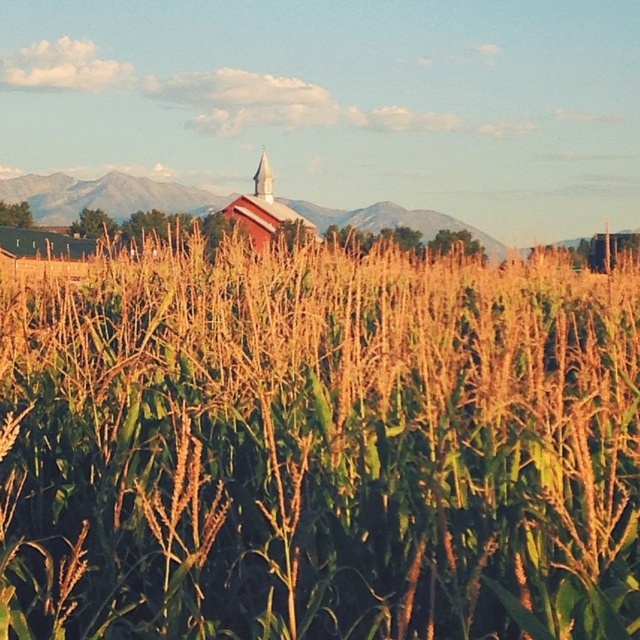
Question: Is green leafy corn at center to the left of smooth silver spire at center from the viewer's perspective?

Choices:
 (A) yes
 (B) no

Answer: (B)

Question: Does green leafy corn at center appear on the right side of matte red barn at center?

Choices:
 (A) no
 (B) yes

Answer: (B)

Question: Which is nearer to the matte red barn at center?

Choices:
 (A) green leafy corn at center
 (B) smooth silver spire at center

Answer: (B)

Question: Among these objects, which one is nearest to the camera?

Choices:
 (A) green leafy corn at center
 (B) matte red barn at center
 (C) smooth silver spire at center

Answer: (A)

Question: Which of the following is the farthest from the observer?

Choices:
 (A) (256, 232)
 (B) (262, 186)

Answer: (B)

Question: Considering the relative positions of green leafy corn at center and matte red barn at center in the image provided, where is green leafy corn at center located with respect to matte red barn at center?

Choices:
 (A) left
 (B) right

Answer: (B)